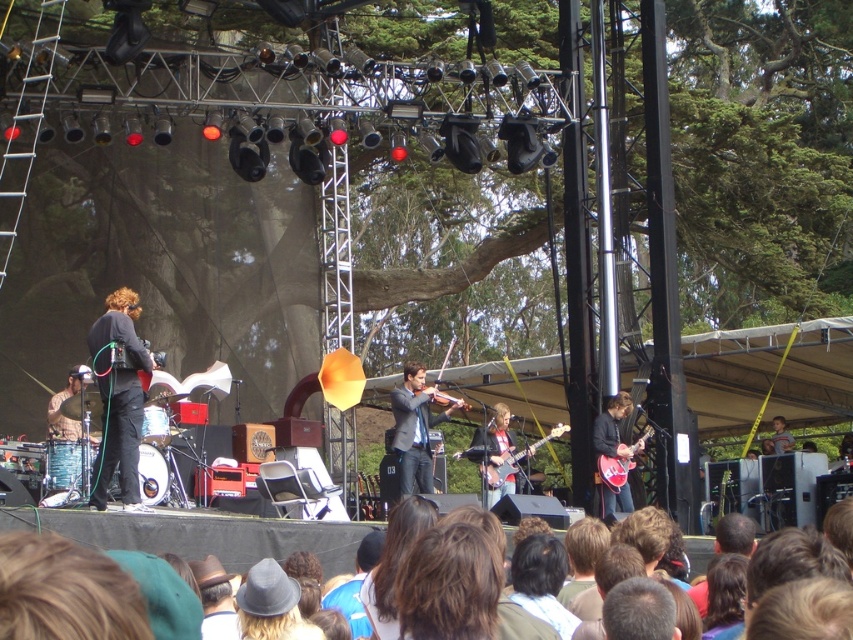
You are a photographer at the concert and want to capture both the matte black violin at center and the matte red electric guitar at center right in the same frame. Based on their positions, which instrument should you position on the left side of your photo?

The matte black violin at center should be positioned on the left side of your photo since it is located to the left of the matte red electric guitar at center right.

You are a stagehand who needs to move a 10 meter long cable from the matte black violin at center to the matte red electric guitar at center right. Will the cable be long enough to reach without needing to extend it?

The distance between the matte black violin at center and the matte red electric guitar at center right is 8.44 meters, so the 10 meter cable is long enough to reach without needing to extend it.

You are a photographer at the concert and want to capture both the matte black violin at center and the matte black electric guitar at center in a single frame. Since you are standing in front of the stage, which instrument should you pan your camera to the right to include first?

The matte black violin at center is to the left of the matte black electric guitar at center. Since you are facing the stage, panning to the right would first capture the electric guitar.